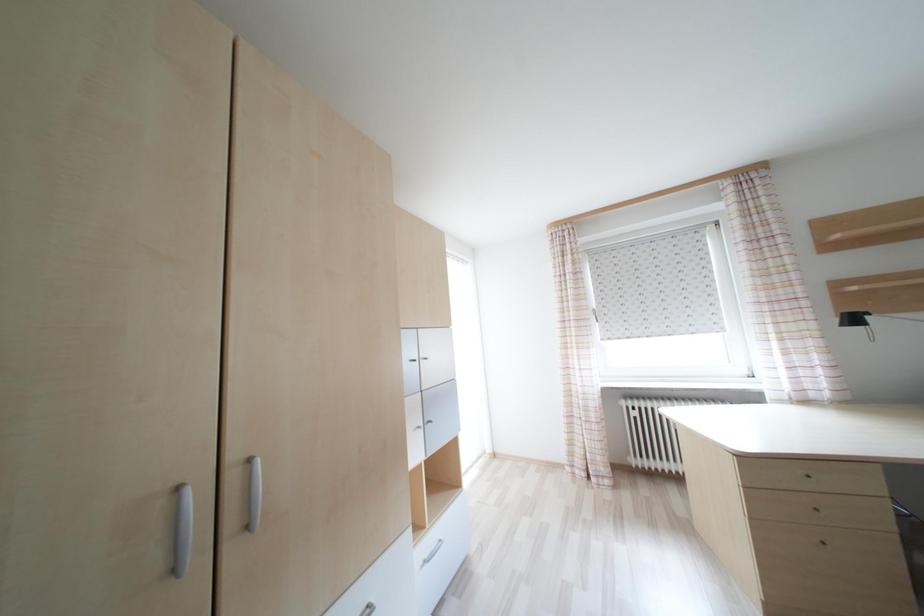
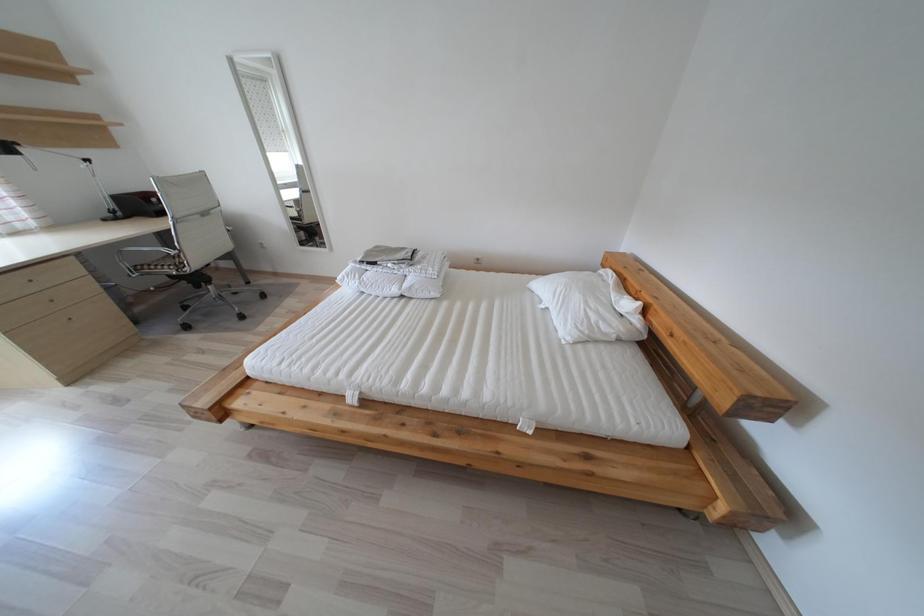
Consider the image. The first image is from the beginning of the video and the second image is from the end. How did the camera likely rotate when shooting the video?

The camera rotated toward right-down.